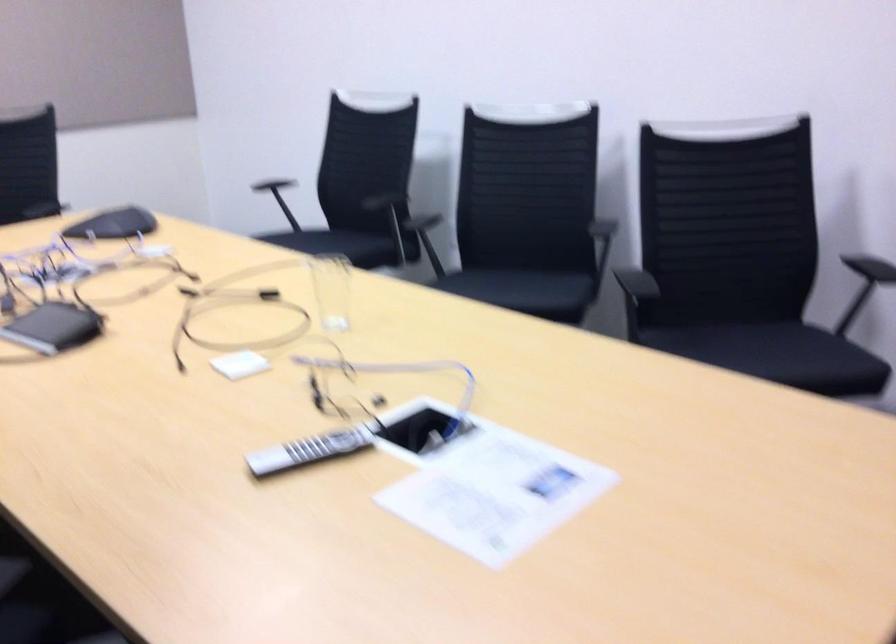
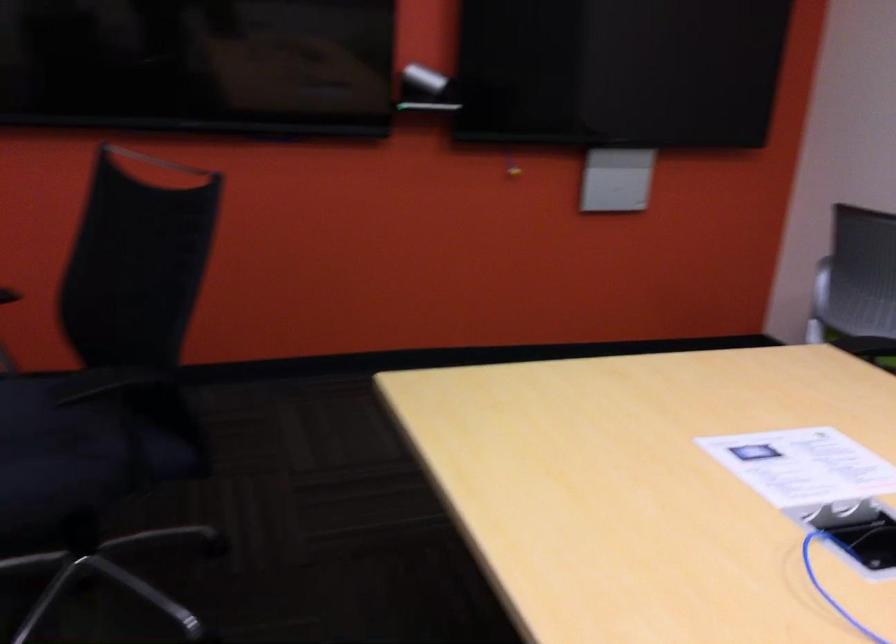
The point at (474,507) is marked in the first image. Where is the corresponding point in the second image?

(803, 466)